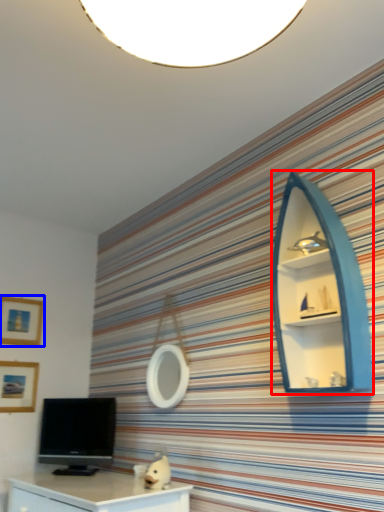
Question: Which point is closer to the camera, shelf (highlighted by a red box) or picture frame (highlighted by a blue box)?

Choices:
 (A) shelf
 (B) picture frame

Answer: (A)